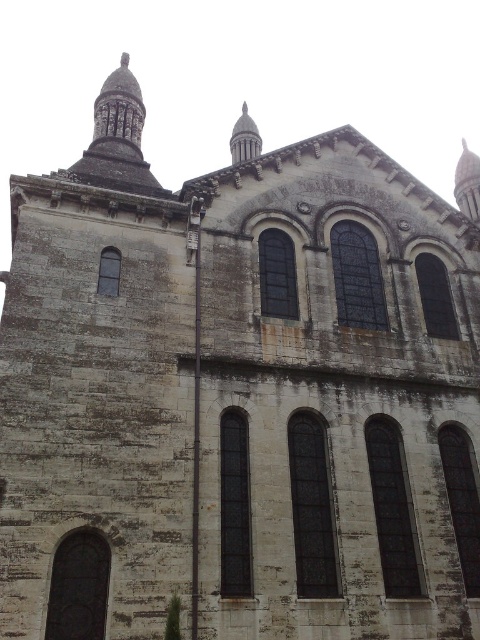
Question: Is smooth gray spire at upper right to the right of smooth gray stone spire at upper center from the viewer's perspective?

Choices:
 (A) yes
 (B) no

Answer: (A)

Question: Is smooth gray spire at upper right bigger than smooth gray stone spire at upper center?

Choices:
 (A) yes
 (B) no

Answer: (A)

Question: Does smooth gray spire at upper right have a greater width compared to smooth gray stone spire at upper center?

Choices:
 (A) yes
 (B) no

Answer: (A)

Question: Among these objects, which one is farthest from the camera?

Choices:
 (A) smooth gray spire at upper right
 (B) smooth gray stone spire at upper center

Answer: (A)

Question: Which point is closer to the camera?

Choices:
 (A) smooth gray spire at upper right
 (B) smooth gray stone spire at upper center

Answer: (B)

Question: Among these points, which one is farthest from the camera?

Choices:
 (A) (477, 208)
 (B) (261, 140)

Answer: (B)